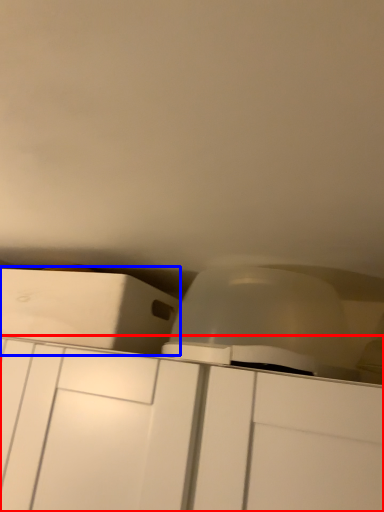
Question: Which point is closer to the camera, cabinetry (highlighted by a red box) or cabinetry (highlighted by a blue box)?

Choices:
 (A) cabinetry
 (B) cabinetry

Answer: (A)